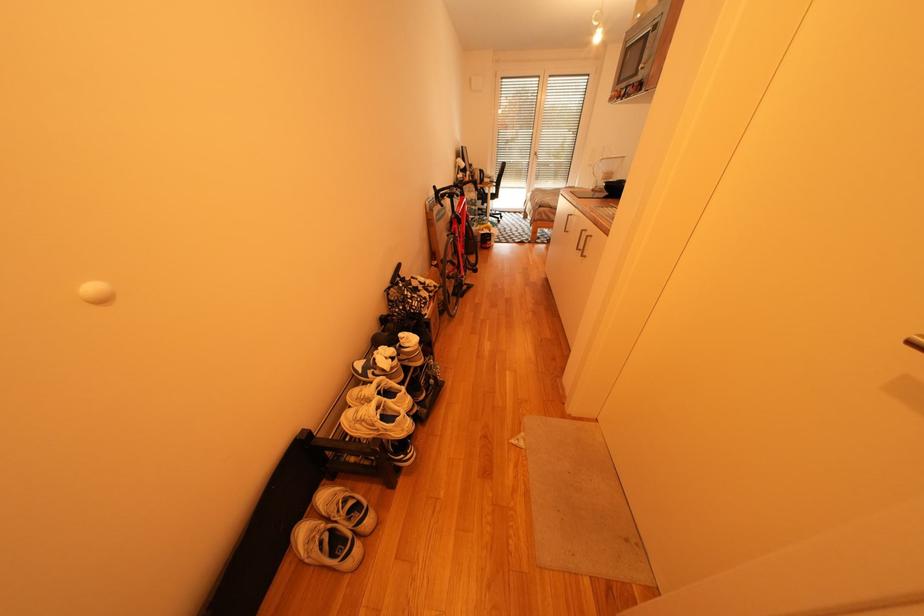
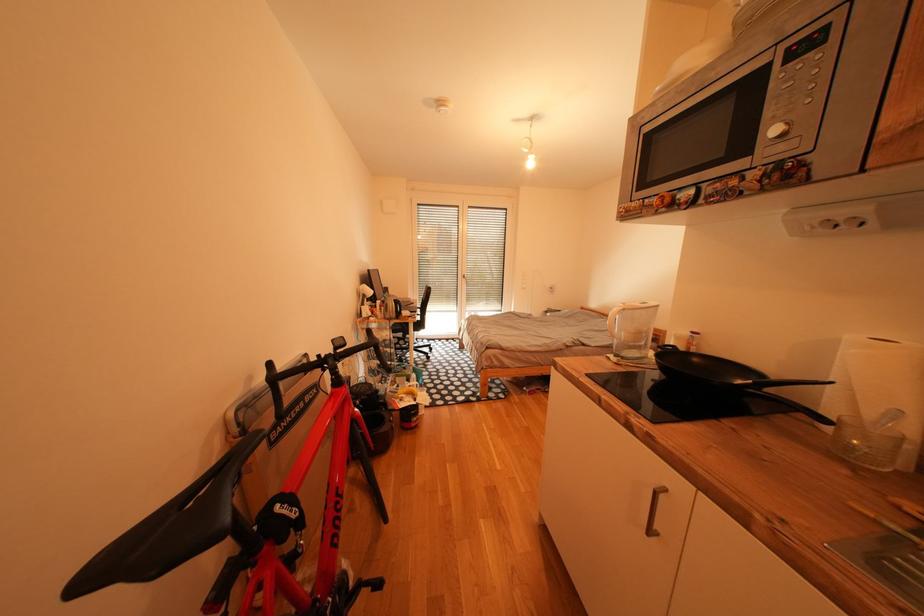
Question: Which direction would the cameraman need to move to produce the second image? Reply with the corresponding letter.

Choices:
 (A) Left
 (B) Right
 (C) Forward
 (D) Backward

Answer: (C)